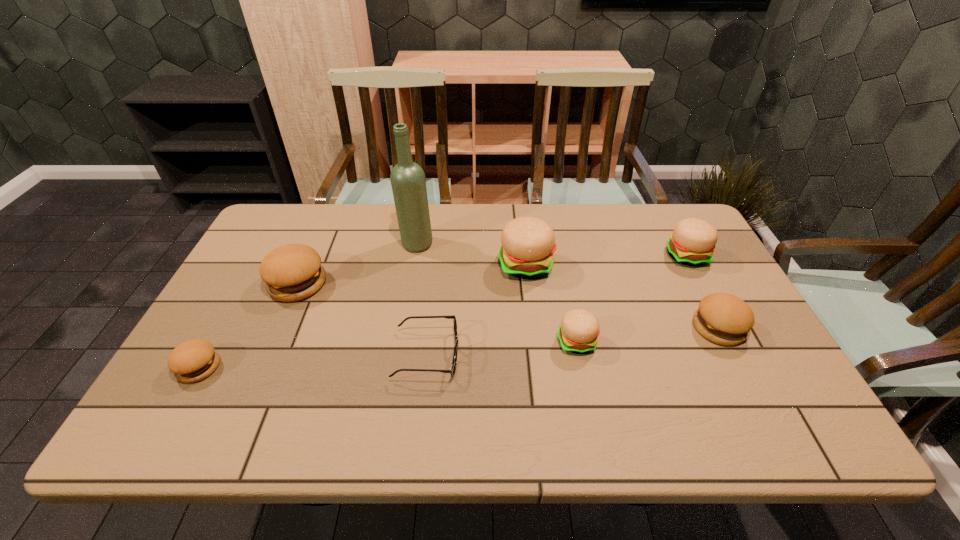
In order to click on green wine bottle in this screenshot , I will do `click(407, 178)`.

Image resolution: width=960 pixels, height=540 pixels. What are the coordinates of `the tallest object` in the screenshot? It's located at (407, 178).

Where is `the tallest hamburger`? This screenshot has width=960, height=540. the tallest hamburger is located at coordinates (528, 243).

Locate an element on the screen. The height and width of the screenshot is (540, 960). the biggest beige hamburger is located at coordinates (528, 243).

Where is `the second biggest beige hamburger`? the second biggest beige hamburger is located at coordinates (693, 241).

This screenshot has width=960, height=540. Find the location of `the farthest brown hamburger`. the farthest brown hamburger is located at coordinates 292,272.

Identify the location of the second brown hamburger from left to right. The height and width of the screenshot is (540, 960). (292, 272).

You are a GUI agent. You are given a task and a screenshot of the screen. Output one action in this format:
    pyautogui.click(x=<x>, y=<y>)
    Task: Click on the rightmost brown hamburger
    The height and width of the screenshot is (540, 960).
    Given the screenshot: What is the action you would take?
    pyautogui.click(x=722, y=318)

Locate an element on the screen. the second nearest brown hamburger is located at coordinates (722, 318).

In order to click on the smallest beige hamburger in this screenshot , I will do `click(579, 329)`.